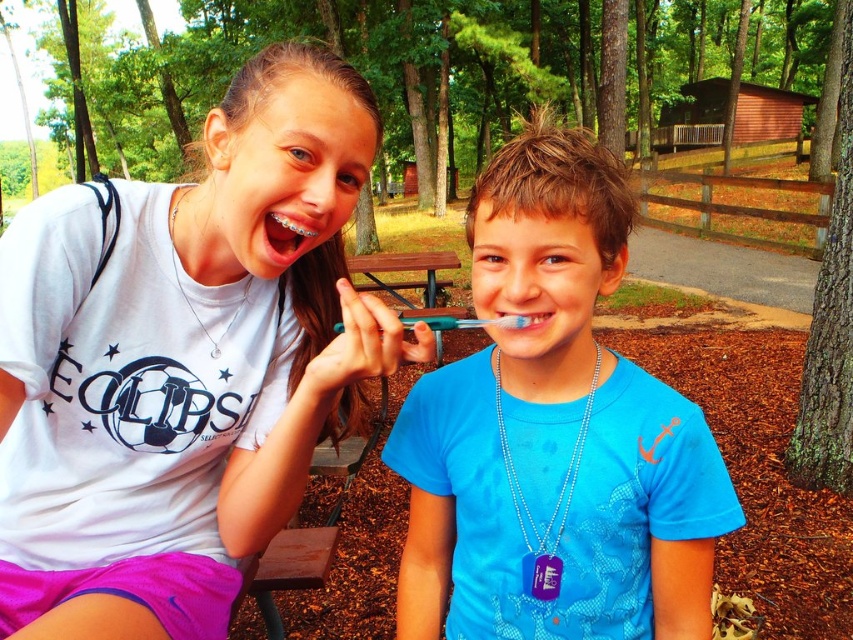
Question: Is white matte t-shirt at upper left below white toothbrush at center?

Choices:
 (A) yes
 (B) no

Answer: (A)

Question: Can you confirm if brown wooden picnic table at center is positioned above white toothbrush at center?

Choices:
 (A) yes
 (B) no

Answer: (A)

Question: Which point is farther to the camera?

Choices:
 (A) (498, 323)
 (B) (404, 252)

Answer: (B)

Question: Which of the following is the closest to the observer?

Choices:
 (A) (305, 252)
 (B) (196, 513)
 (C) (372, 289)
 (D) (503, 321)

Answer: (D)

Question: Estimate the real-world distances between objects in this image. Which object is farther from the white toothbrush at center?

Choices:
 (A) blue matte toothbrush at center
 (B) blue plastic toothbrush at center
 (C) metallic braces at center

Answer: (B)

Question: Does brown wooden picnic table at center come behind blue plastic toothbrush at center?

Choices:
 (A) no
 (B) yes

Answer: (A)